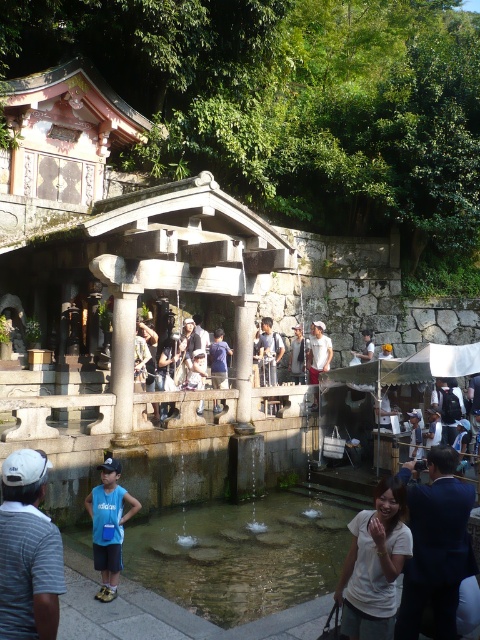
Question: Can you confirm if clear water at fountain center is positioned to the left of white cotton shirt at lower right?

Choices:
 (A) no
 (B) yes

Answer: (B)

Question: Which of the following is the closest to the observer?

Choices:
 (A) (120, 536)
 (B) (348, 516)
 (C) (356, 552)

Answer: (C)

Question: Which point is closer to the camera taking this photo?

Choices:
 (A) (277, 568)
 (B) (11, 472)
 (C) (396, 605)

Answer: (B)

Question: Does clear water at fountain center have a larger size compared to white cotton shirt at lower right?

Choices:
 (A) yes
 (B) no

Answer: (A)

Question: Estimate the real-world distances between objects in this image. Which object is farther from the white cotton shirt at lower right?

Choices:
 (A) white matte shirt at lower center
 (B) white striped shirt at lower left
 (C) clear water at fountain center
 (D) blue fabric shirt at center

Answer: (C)

Question: Is the position of white cotton shirt at lower right less distant than that of white striped shirt at lower left?

Choices:
 (A) yes
 (B) no

Answer: (B)